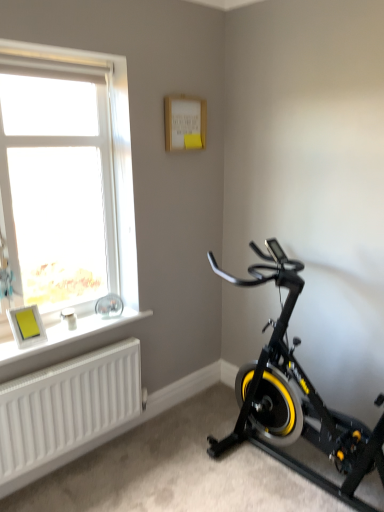
Locate an element on the screen. The width and height of the screenshot is (384, 512). free space underneath black matte stationary bicycle at lower right (from a real-world perspective) is located at coordinates (289, 472).